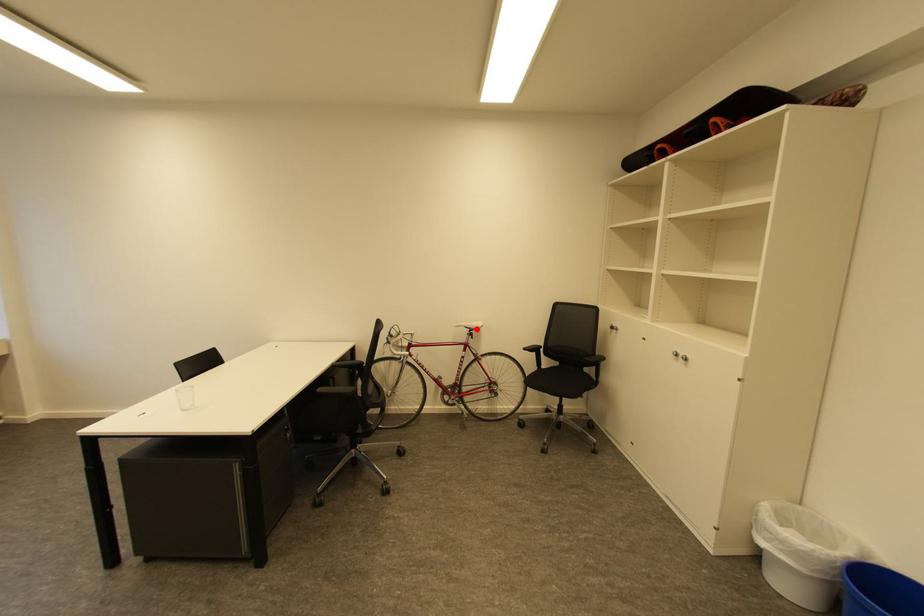
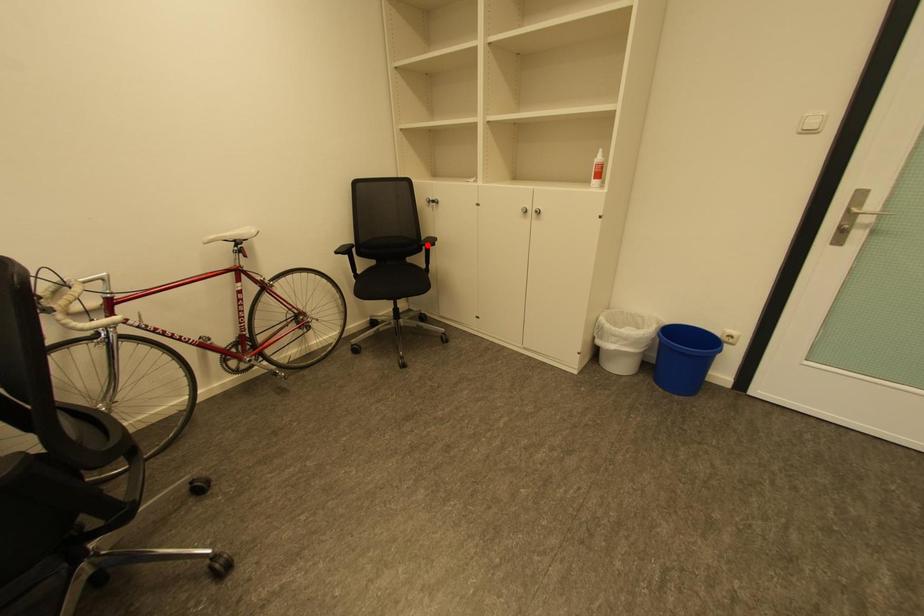
I am providing you with two images of the same scene from different viewpoints. A red point is marked on the first image and another point is marked on the second image. Are the points marked in image1 and image2 representing the same 3D position?

No